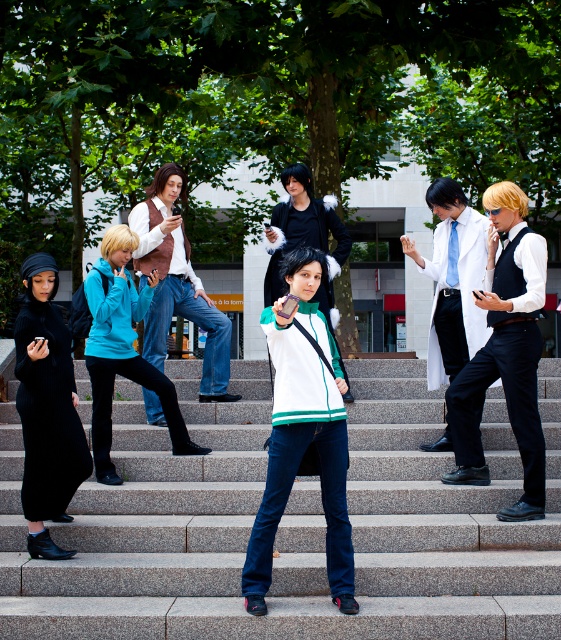
Which is more to the right, ribbed black dress at lower left or matte black wig at center?

From the viewer's perspective, matte black wig at center appears more on the right side.

Describe the element at coordinates (47, 408) in the screenshot. I see `ribbed black dress at lower left` at that location.

Locate an element on the screen. ribbed black dress at lower left is located at coordinates (47, 408).

Is white matte jacket at center to the right of matte white vest at center from the viewer's perspective?

No, white matte jacket at center is not to the right of matte white vest at center.

Who is positioned more to the right, white matte jacket at center or matte white vest at center?

matte white vest at center

Find the location of a particular element. The image size is (561, 640). white matte jacket at center is located at coordinates (302, 435).

Can you confirm if matte white vest at center is positioned below denim pants at center?

Correct, matte white vest at center is located below denim pants at center.

Does matte white vest at center have a lesser height compared to denim pants at center?

Yes, matte white vest at center is shorter than denim pants at center.

What do you see at coordinates (505, 353) in the screenshot? This screenshot has height=640, width=561. I see `matte white vest at center` at bounding box center [505, 353].

Locate an element on the screen. The width and height of the screenshot is (561, 640). matte white vest at center is located at coordinates (505, 353).